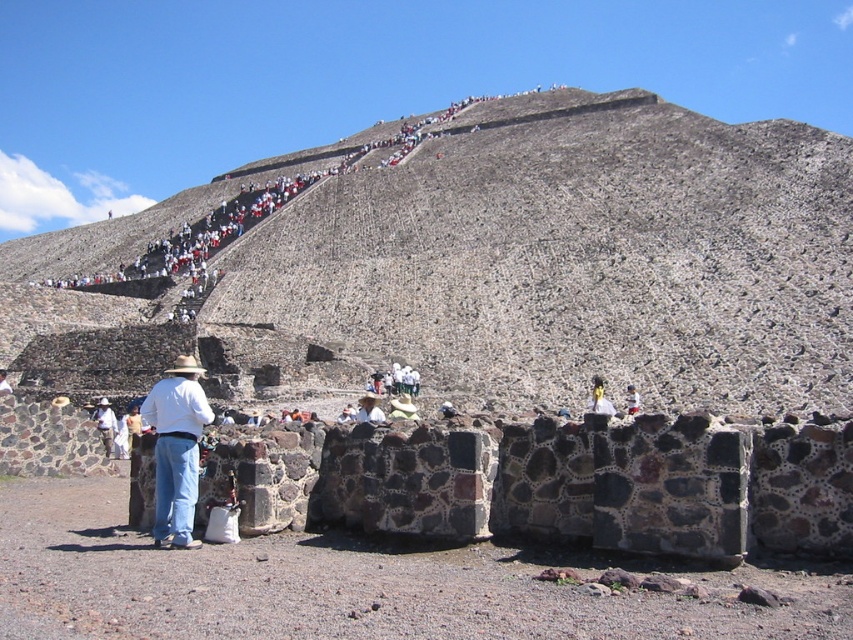
Consider the image. You are a photographer trying to capture a photo of the Pyramid of the Sun. You have a white woven hat at center and light blue denim jeans at lower center in your frame. Which object is taller in the image?

The white woven hat at center is much taller than light blue denim jeans at lower center in the image.

You are a photographer trying to capture a clear shot of the Pyramid of the Sun. You notice the white woven hat at center and the light blue denim jeans at lower center are blocking your view. Which object should you move to minimize obstruction?

The white woven hat at center might be wider than light blue denim jeans at lower center, so moving the white woven hat at center would likely reduce the obstruction more effectively.

You are a photographer trying to capture a clear shot of the Pyramid of the Sun. You notice the yellow fabric hat at center and the light blue denim jeans at lower center are blocking your view. Which object is taller and might be more obstructive?

The yellow fabric hat at center is taller than the light blue denim jeans at lower center, making it the more obstructive object.